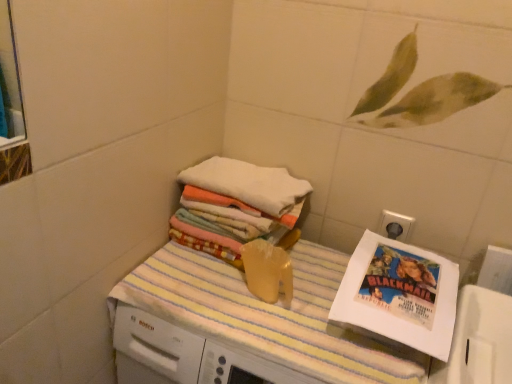
Image resolution: width=512 pixels, height=384 pixels. Describe the element at coordinates (248, 184) in the screenshot. I see `white soft towels at upper center` at that location.

Measure the distance between point [412,220] and camera.

1.03 meters.

At what (x,y) coordinates should I click in order to perform the action: click on white soft towels at upper center. Please return your answer as a coordinate pair (x, y). The image size is (512, 384). Looking at the image, I should click on (248, 184).

Is there a large distance between white soft towels at upper center and yellow striped towel at center?

No, white soft towels at upper center is not far away from yellow striped towel at center.

From the image's perspective, between white soft towels at upper center and yellow striped towel at center, which one is located above?

white soft towels at upper center is shown above in the image.

Locate an element on the screen. This screenshot has height=384, width=512. towel behind the yellow striped towel at center is located at coordinates (248, 184).

Is there a large distance between white paper comic book at right and yellow striped towel at center?

Actually, white paper comic book at right and yellow striped towel at center are a little close together.

Does white paper comic book at right have a smaller size compared to yellow striped towel at center?

Yes.

Which object is further away from the camera, white paper comic book at right or yellow striped towel at center?

white paper comic book at right is further away from the camera.

How different are the orientations of white paper comic book at right and yellow striped towel at center in degrees?

white paper comic book at right and yellow striped towel at center are facing 1.95 degrees away from each other.

From a real-world perspective, between white soft towels at upper center and white plastic electric outlet at upper right, who is vertically lower?

white plastic electric outlet at upper right, from a real-world perspective.

From the image's perspective, is white soft towels at upper center located above white plastic electric outlet at upper right?

Yes.

Find the location of a particular element. electric outlet below the white soft towels at upper center (from the image's perspective) is located at coordinates (395, 225).

Which object is closer to the camera, white soft towels at upper center or white plastic electric outlet at upper right?

white soft towels at upper center is in front.

Is white plastic electric outlet at upper right positioned beyond the bounds of yellow striped towel at center?

Yes, white plastic electric outlet at upper right is not within yellow striped towel at center.

From a real-world perspective, is white plastic electric outlet at upper right positioned over yellow striped towel at center based on gravity?

Correct, in the physical world, white plastic electric outlet at upper right is higher than yellow striped towel at center.

From the picture: Is white plastic electric outlet at upper right taller or shorter than yellow striped towel at center?

white plastic electric outlet at upper right is shorter than yellow striped towel at center.

Is white plastic electric outlet at upper right to the left or to the right of yellow striped towel at center in the image?

From the image, it's evident that white plastic electric outlet at upper right is to the right of yellow striped towel at center.

From the picture: What's the angular difference between white soft towels at upper center and white paper comic book at right's facing directions?

white soft towels at upper center and white paper comic book at right are facing 0.239 degrees away from each other.

Are white soft towels at upper center and white paper comic book at right far apart?

white soft towels at upper center is near white paper comic book at right, not far away.

Considering the sizes of objects white soft towels at upper center and white paper comic book at right in the image provided, who is thinner, white soft towels at upper center or white paper comic book at right?

white paper comic book at right is thinner.

From the image's perspective, is white soft towels at upper center above or below white paper comic book at right?

From the image's perspective, white soft towels at upper center appears above white paper comic book at right.

Image resolution: width=512 pixels, height=384 pixels. Identify the location of electric outlet above the white paper comic book at right (from a real-world perspective). (395, 225).

Are white plastic electric outlet at upper right and white paper comic book at right making contact?

No, white plastic electric outlet at upper right is not in contact with white paper comic book at right.

Is white paper comic book at right surrounded by white plastic electric outlet at upper right?

No, white paper comic book at right is not surrounded by white plastic electric outlet at upper right.

From a real-world perspective, does yellow striped towel at center stand above white plastic electric outlet at upper right?

Incorrect, from a real-world perspective, yellow striped towel at center is lower than white plastic electric outlet at upper right.

Could you tell me if yellow striped towel at center is facing white plastic electric outlet at upper right?

No, yellow striped towel at center is not facing towards white plastic electric outlet at upper right.

What's the angular difference between yellow striped towel at center and white plastic electric outlet at upper right's facing directions?

They differ by 0.178 degrees in their facing directions.

Based on the photo, considering the positions of objects yellow striped towel at center and white plastic electric outlet at upper right in the image provided, who is in front, yellow striped towel at center or white plastic electric outlet at upper right?

yellow striped towel at center is more forward.

At what (x,y) coordinates should I click in order to perform the action: click on towel behind the yellow striped towel at center. Please return your answer as a coordinate pair (x, y). Looking at the image, I should click on (248, 184).

The width and height of the screenshot is (512, 384). I want to click on comic book that appears on the right of yellow striped towel at center, so click(x=401, y=284).

Looking at the image, which one is located further to white soft towels at upper center, yellow striped towel at center or white paper comic book at right?

white paper comic book at right is positioned further to the anchor white soft towels at upper center.

When comparing their distances from white paper comic book at right, does yellow striped towel at center or white soft towels at upper center seem further?

Based on the image, white soft towels at upper center appears to be further to white paper comic book at right.

Looking at the image, which one is located closer to yellow striped towel at center, white soft towels at upper center or white paper comic book at right?

white paper comic book at right is positioned closer to the anchor yellow striped towel at center.

Based on their spatial positions, is white paper comic book at right or yellow striped towel at center further from white plastic electric outlet at upper right?

Based on the image, yellow striped towel at center appears to be further to white plastic electric outlet at upper right.

Consider the image. When comparing their distances from white soft towels at upper center, does white plastic electric outlet at upper right or white paper comic book at right seem further?

Among the two, white plastic electric outlet at upper right is located further to white soft towels at upper center.

Looking at the image, which one is located further to white plastic electric outlet at upper right, white paper comic book at right or white soft towels at upper center?

white soft towels at upper center is further to white plastic electric outlet at upper right.

Looking at the image, which one is located closer to white soft towels at upper center, white plastic electric outlet at upper right or yellow striped towel at center?

Based on the image, yellow striped towel at center appears to be nearer to white soft towels at upper center.

Considering their positions, is yellow striped towel at center positioned closer to white paper comic book at right than white plastic electric outlet at upper right?

The object closer to white paper comic book at right is white plastic electric outlet at upper right.

You are a GUI agent. You are given a task and a screenshot of the screen. Output one action in this format:
    pyautogui.click(x=<x>, y=<y>)
    Task: Click on the tablecloth between white soft towels at upper center and white paper comic book at right in the horizontal direction
    This screenshot has width=512, height=384.
    Given the screenshot: What is the action you would take?
    pyautogui.click(x=266, y=313)

At what (x,y) coordinates should I click in order to perform the action: click on comic book between yellow striped towel at center and white plastic electric outlet at upper right along the z-axis. Please return your answer as a coordinate pair (x, y). The width and height of the screenshot is (512, 384). Looking at the image, I should click on (401, 284).

Find the location of `comic book between white soft towels at upper center and white plastic electric outlet at upper right in the horizontal direction`. comic book between white soft towels at upper center and white plastic electric outlet at upper right in the horizontal direction is located at coordinates (401, 284).

Image resolution: width=512 pixels, height=384 pixels. Find the location of `tablecloth between white soft towels at upper center and white plastic electric outlet at upper right in the horizontal direction`. tablecloth between white soft towels at upper center and white plastic electric outlet at upper right in the horizontal direction is located at coordinates (266, 313).